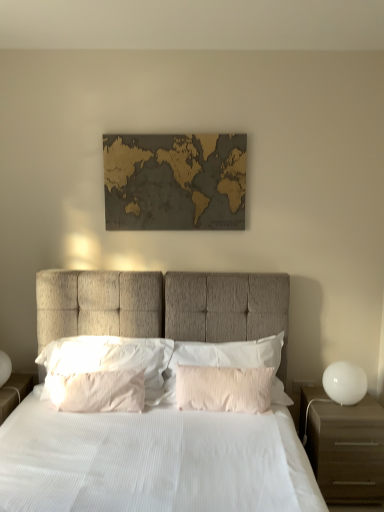
Question: In which direction should I rotate to look at pink textured pillow at center, marked as the 4th pillow in a left-to-right arrangement?

Choices:
 (A) right
 (B) left

Answer: (A)

Question: Does pink textured pillow at center, marked as the 4th pillow in a left-to-right arrangement, have a lesser width compared to wooden map at center?

Choices:
 (A) no
 (B) yes

Answer: (A)

Question: From a real-world perspective, is pink textured pillow at center, the first pillow positioned from the right, physically above wooden map at center?

Choices:
 (A) yes
 (B) no

Answer: (B)

Question: Considering the relative sizes of pink textured pillow at center, marked as the 4th pillow in a left-to-right arrangement, and wooden map at center in the image provided, is pink textured pillow at center, marked as the 4th pillow in a left-to-right arrangement, wider than wooden map at center?

Choices:
 (A) no
 (B) yes

Answer: (B)

Question: Does pink textured pillow at center, marked as the 4th pillow in a left-to-right arrangement, appear on the right side of wooden map at center?

Choices:
 (A) no
 (B) yes

Answer: (B)

Question: Can you confirm if pink textured pillow at center, marked as the 4th pillow in a left-to-right arrangement, is positioned to the left of wooden map at center?

Choices:
 (A) no
 (B) yes

Answer: (A)

Question: Is pink textured pillow at center, marked as the 4th pillow in a left-to-right arrangement, smaller than wooden map at center?

Choices:
 (A) yes
 (B) no

Answer: (B)

Question: Does white glossy sphere at right have a lesser height compared to brown matte nightstand at right?

Choices:
 (A) no
 (B) yes

Answer: (B)

Question: From the image's perspective, is white glossy sphere at right under brown matte nightstand at right?

Choices:
 (A) yes
 (B) no

Answer: (B)

Question: Is white glossy sphere at right taller than brown matte nightstand at right?

Choices:
 (A) no
 (B) yes

Answer: (A)

Question: From the image's perspective, is white glossy sphere at right on brown matte nightstand at right?

Choices:
 (A) yes
 (B) no

Answer: (A)

Question: Does white glossy sphere at right touch brown matte nightstand at right?

Choices:
 (A) no
 (B) yes

Answer: (A)

Question: From a real-world perspective, is white glossy sphere at right located beneath brown matte nightstand at right?

Choices:
 (A) no
 (B) yes

Answer: (A)

Question: Is white soft pillow at center, the 4th pillow in the right-to-left sequence, not inside white fabric bed at center?

Choices:
 (A) yes
 (B) no

Answer: (B)